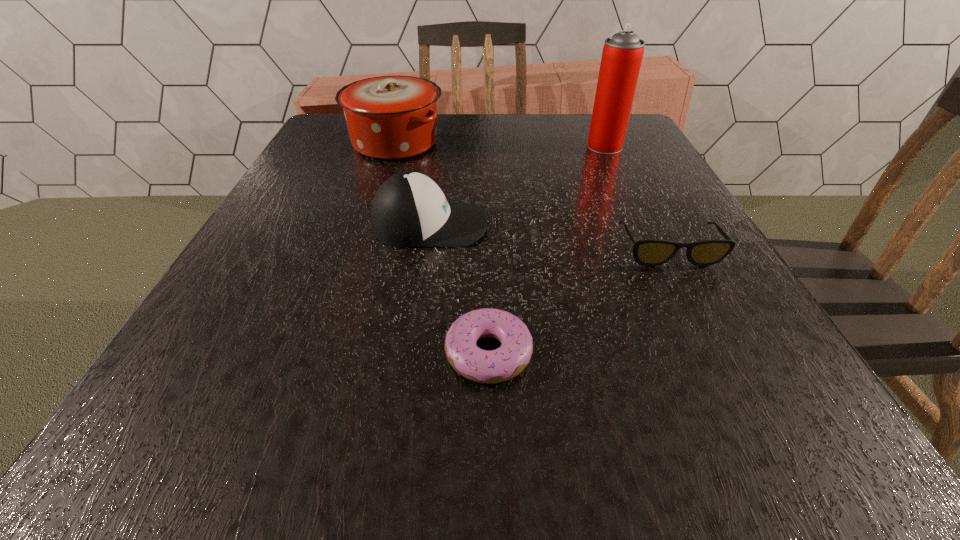
The width and height of the screenshot is (960, 540). Find the location of `aerosol can`. aerosol can is located at coordinates (622, 55).

Where is `the fourth shortest object`? the fourth shortest object is located at coordinates (388, 118).

Find the location of a particular element. Image resolution: width=960 pixels, height=540 pixels. cap is located at coordinates (409, 209).

Where is `the second shortest object`? Image resolution: width=960 pixels, height=540 pixels. the second shortest object is located at coordinates (651, 252).

You are a GUI agent. You are given a task and a screenshot of the screen. Output one action in this format:
    pyautogui.click(x=<x>, y=<y>)
    Task: Click on the doughnut
    This screenshot has width=960, height=540.
    Given the screenshot: What is the action you would take?
    pyautogui.click(x=487, y=367)

Where is `the shortest object`? The image size is (960, 540). the shortest object is located at coordinates (487, 367).

Where is `vacant space located 0.340m on the left of the tallest object`? This screenshot has height=540, width=960. vacant space located 0.340m on the left of the tallest object is located at coordinates (445, 146).

What are the coordinates of `free spot located 0.070m on the right of the fourth shortest object` in the screenshot? It's located at (473, 143).

Locate an element on the screen. The image size is (960, 540). vacant space located on the front panel of the third shortest object is located at coordinates (600, 225).

Locate an element on the screen. The image size is (960, 540). vacant region located on the front-facing side of the sunglasses is located at coordinates (771, 451).